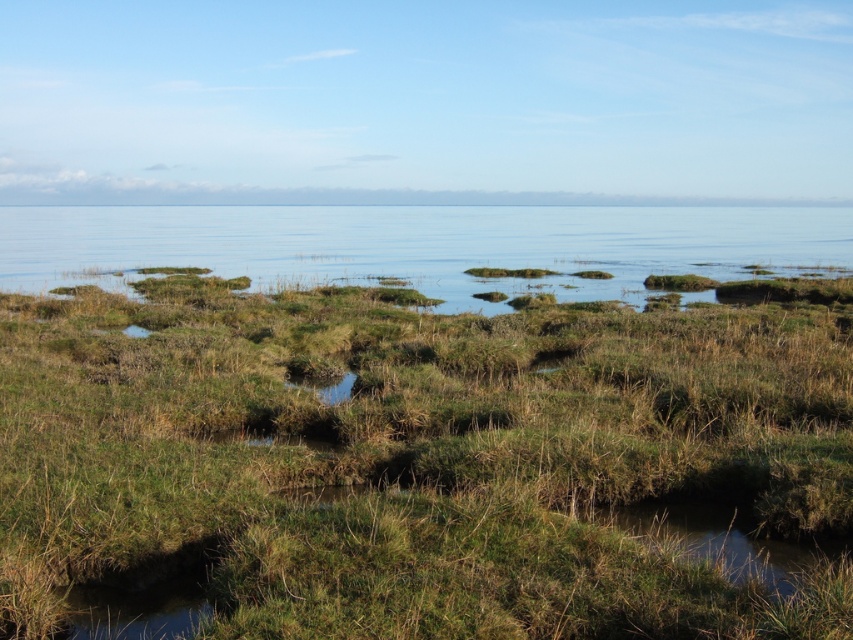
You are a bird flying over the coastal landscape. You need to land on a spot that has enough space to rest. Which area would you choose between the green grassy at center and the clear blue water at center?

The clear blue water at center has a greater width than the green grassy at center, so the bird should choose the clear blue water at center for landing as it offers more space to rest.

You are standing at the edge of the marsh and want to cross to the other side. You see the green grassy at center and the clear blue water at center. Which one is lower and safer to step on?

The green grassy at center is shorter than the clear blue water at center, so stepping on the green grassy at center would be lower and safer.

Looking at this image, you are standing at the point marked by the coordinates point [416,460] in the image. What type of vegetation do you see around you?

The point [416,460] is labeled as green grassy at center, so you are surrounded by green grassy vegetation.